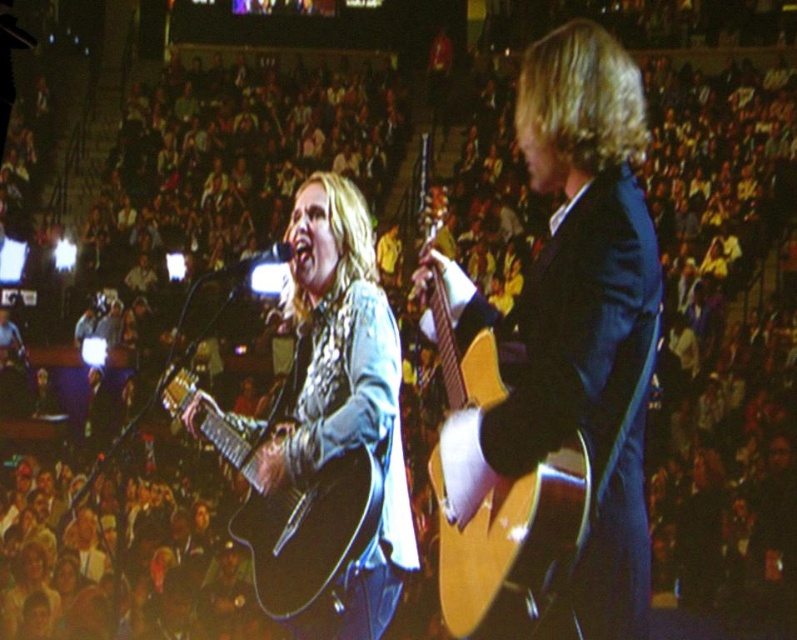
Who is higher up, matte black guitar at center or matte black acoustic guitar at center?

matte black guitar at center

Which is more to the right, matte black guitar at center or matte black acoustic guitar at center?

matte black guitar at center is more to the right.

Who is more distant from viewer, (303, 188) or (281, 525)?

Positioned behind is point (303, 188).

Identify the location of matte black guitar at center. This screenshot has height=640, width=797. (344, 396).

Can you confirm if shiny brown guitar at center is positioned above matte black acoustic guitar at center?

Yes.

Looking at this image, is shiny brown guitar at center smaller than matte black acoustic guitar at center?

No, shiny brown guitar at center is not smaller than matte black acoustic guitar at center.

Where is `shiny brown guitar at center`? The height and width of the screenshot is (640, 797). shiny brown guitar at center is located at coordinates (572, 324).

Is point (579, 35) farther from camera compared to point (356, 589)?

No, it is not.

Can you confirm if shiny brown guitar at center is taller than matte black guitar at center?

Indeed, shiny brown guitar at center has a greater height compared to matte black guitar at center.

Is point (422, 285) positioned behind point (320, 184)?

No, (422, 285) is closer to viewer.

Locate an element on the screen. This screenshot has width=797, height=640. shiny brown guitar at center is located at coordinates (572, 324).